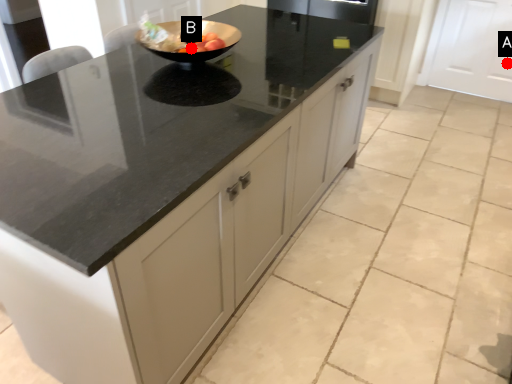
Question: Two points are circled on the image, labeled by A and B beside each circle. Which point is farther to the camera?

Choices:
 (A) A is further
 (B) B is further

Answer: (A)